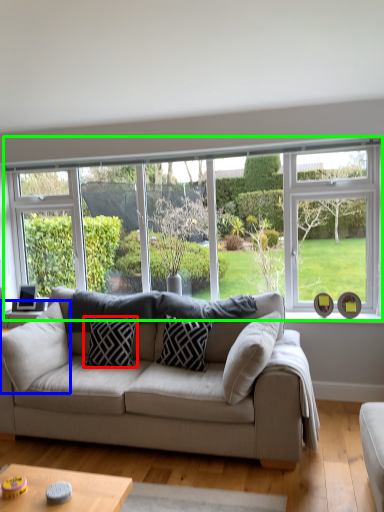
Question: Considering the real-world distances, which object is closest to pillow (highlighted by a red box)? pillow (highlighted by a blue box) or window (highlighted by a green box).

Choices:
 (A) pillow
 (B) window

Answer: (A)